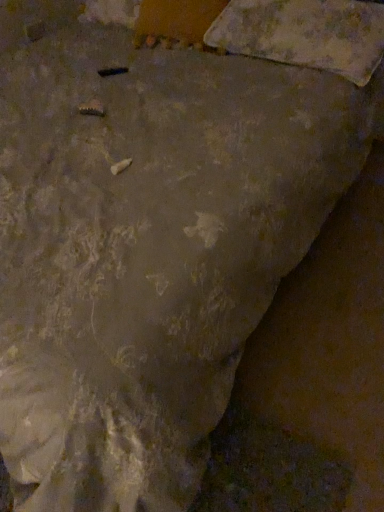
Question: Should I look upward or downward to see camouflage fabric pillow at upper right?

Choices:
 (A) up
 (B) down

Answer: (A)